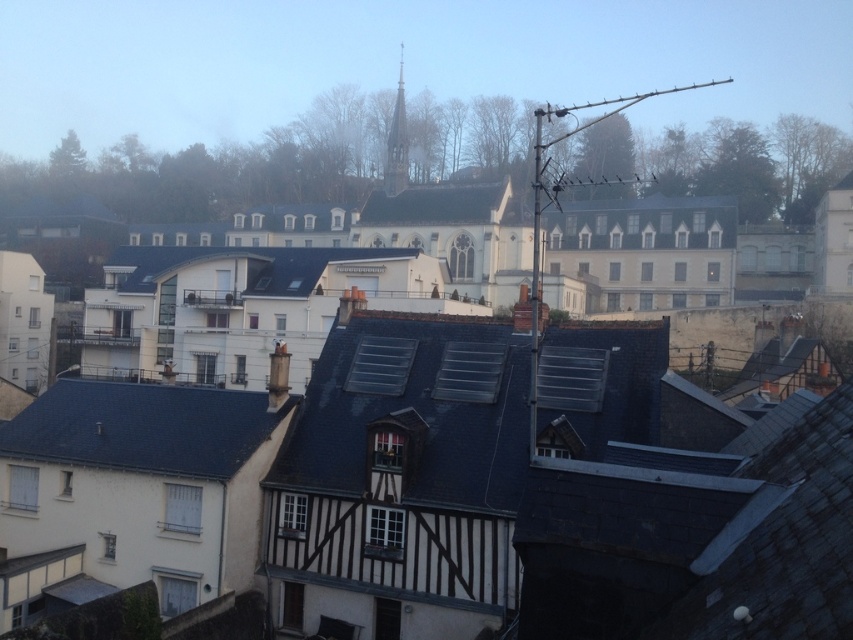
You are standing at the center of the image and want to locate the dark gray slate roof at lower left. Which direction should you turn to face it?

The dark gray slate roof at lower left is located at point (142, 428), which is to the lower left from your current position at the center. Turn left and look downward to face it.

You are standing in the European urban landscape and want to walk towards the point that is closer to you. Which point should you walk towards, point (148, 426) or point (257, 296)?

You should walk towards point (148, 426) because it is in front of point (257, 296), meaning it is closer to you.